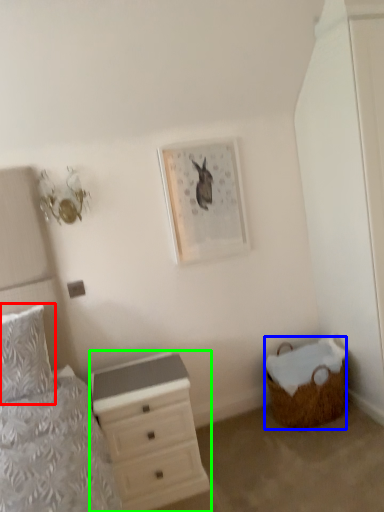
Question: Which is nearer to the pillow (highlighted by a red box)? basket (highlighted by a blue box) or chest of drawers (highlighted by a green box).

Choices:
 (A) basket
 (B) chest of drawers

Answer: (B)